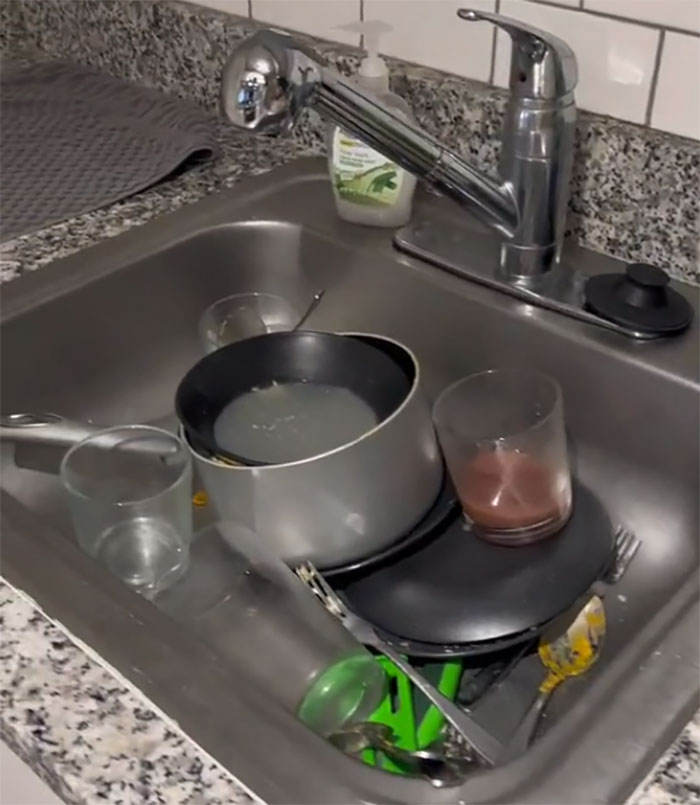
Locate an element on the screen. The width and height of the screenshot is (700, 805). sink is located at coordinates (204, 709), (127, 374), (435, 304), (657, 456).